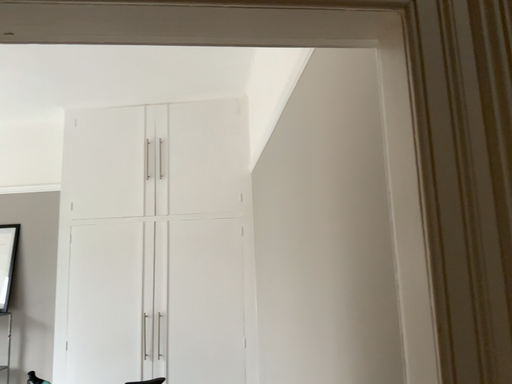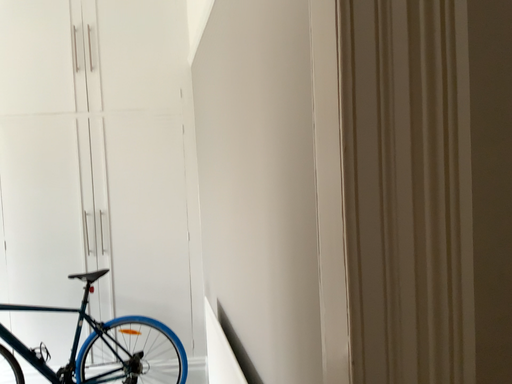
Question: How did the camera likely rotate when shooting the video?

Choices:
 (A) rotated upward
 (B) rotated downward

Answer: (B)